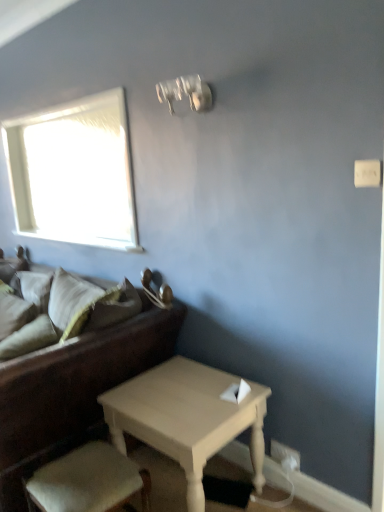
The height and width of the screenshot is (512, 384). What do you see at coordinates (29, 338) in the screenshot?
I see `soft beige pillow at left, the 1th pillow in the front-to-back sequence` at bounding box center [29, 338].

The image size is (384, 512). What are the coordinates of `light beige fabric armchair at lower left` in the screenshot? It's located at (88, 481).

The image size is (384, 512). What do you see at coordinates (88, 481) in the screenshot?
I see `light beige fabric armchair at lower left` at bounding box center [88, 481].

The width and height of the screenshot is (384, 512). In order to click on soft beige pillow at left, which ranks as the 2th pillow in front-to-back order in this screenshot , I will do `click(14, 313)`.

Based on their sizes in the image, would you say light beige fabric armchair at lower left is bigger or smaller than soft beige pillow at left, which ranks as the 2th pillow in front-to-back order?

Considering their sizes, light beige fabric armchair at lower left takes up less space than soft beige pillow at left, which ranks as the 2th pillow in front-to-back order.

Locate an element on the screen. This screenshot has height=512, width=384. armchair below the soft beige pillow at left, which ranks as the 2th pillow in front-to-back order (from the image's perspective) is located at coordinates (88, 481).

From the image's perspective, is light beige fabric armchair at lower left over soft beige pillow at left, which appears as the first pillow when viewed from the back?

Actually, light beige fabric armchair at lower left appears below soft beige pillow at left, which appears as the first pillow when viewed from the back, in the image.

Are soft beige pillow at left, which appears as the first pillow when viewed from the back, and dark brown leather couch at left beside each other?

soft beige pillow at left, which appears as the first pillow when viewed from the back, and dark brown leather couch at left are clearly separated.

Identify the location of pillow on the left side of dark brown leather couch at left. Image resolution: width=384 pixels, height=512 pixels. (14, 313).

How many degrees apart are the facing directions of soft beige pillow at left, which appears as the first pillow when viewed from the back, and dark brown leather couch at left?

0.892 degrees.

Is soft beige pillow at left, which ranks as the 2th pillow in front-to-back order, spatially inside dark brown leather couch at left, or outside of it?

soft beige pillow at left, which ranks as the 2th pillow in front-to-back order, is spatially positioned inside dark brown leather couch at left.

Does soft beige pillow at left, the 1th pillow in the front-to-back sequence, have a greater width compared to soft beige pillow at left, which appears as the first pillow when viewed from the back?

Correct, the width of soft beige pillow at left, the 1th pillow in the front-to-back sequence, exceeds that of soft beige pillow at left, which appears as the first pillow when viewed from the back.

Is soft beige pillow at left, marked as the 2th pillow in a back-to-front arrangement, to the right of soft beige pillow at left, which appears as the first pillow when viewed from the back, from the viewer's perspective?

Correct, you'll find soft beige pillow at left, marked as the 2th pillow in a back-to-front arrangement, to the right of soft beige pillow at left, which appears as the first pillow when viewed from the back.

Looking at this image, how different are the orientations of soft beige pillow at left, the 1th pillow in the front-to-back sequence, and soft beige pillow at left, which ranks as the 2th pillow in front-to-back order, in degrees?

19.5 degrees separate the facing orientations of soft beige pillow at left, the 1th pillow in the front-to-back sequence, and soft beige pillow at left, which ranks as the 2th pillow in front-to-back order.

Which of these two, soft beige pillow at left, which ranks as the 2th pillow in front-to-back order, or light wood table at center, is wider?

With larger width is light wood table at center.

Considering the positions of points (16, 329) and (134, 413), is point (16, 329) farther from camera compared to point (134, 413)?

Yes, it is.

Which is more to the left, soft beige pillow at left, which appears as the first pillow when viewed from the back, or light wood table at center?

soft beige pillow at left, which appears as the first pillow when viewed from the back.

Do you think soft beige pillow at left, which ranks as the 2th pillow in front-to-back order, is within light wood table at center, or outside of it?

soft beige pillow at left, which ranks as the 2th pillow in front-to-back order, is not inside light wood table at center, it's outside.

Is soft beige pillow at left, the 1th pillow in the front-to-back sequence, at the back of dark brown leather couch at left?

Absolutely, dark brown leather couch at left is directed away from soft beige pillow at left, the 1th pillow in the front-to-back sequence.

Between dark brown leather couch at left and soft beige pillow at left, the 1th pillow in the front-to-back sequence, which one is positioned in front?

Positioned in front is dark brown leather couch at left.

Which of these two, dark brown leather couch at left or soft beige pillow at left, marked as the 2th pillow in a back-to-front arrangement, stands shorter?

soft beige pillow at left, marked as the 2th pillow in a back-to-front arrangement, is shorter.

In terms of height, does light wood table at center look taller or shorter compared to soft beige pillow at left, which appears as the first pillow when viewed from the back?

light wood table at center is taller than soft beige pillow at left, which appears as the first pillow when viewed from the back.

Who is smaller, light wood table at center or soft beige pillow at left, which ranks as the 2th pillow in front-to-back order?

With smaller size is soft beige pillow at left, which ranks as the 2th pillow in front-to-back order.

Is light wood table at center in front of or behind soft beige pillow at left, which ranks as the 2th pillow in front-to-back order, in the image?

light wood table at center is positioned closer to the viewer than soft beige pillow at left, which ranks as the 2th pillow in front-to-back order.

Is point (54, 378) farther from viewer compared to point (9, 318)?

No, it is in front of (9, 318).

Who is bigger, dark brown leather couch at left or soft beige pillow at left, which ranks as the 2th pillow in front-to-back order?

With larger size is dark brown leather couch at left.

Measure the distance between dark brown leather couch at left and soft beige pillow at left, which ranks as the 2th pillow in front-to-back order.

A distance of 38.85 inches exists between dark brown leather couch at left and soft beige pillow at left, which ranks as the 2th pillow in front-to-back order.

Between dark brown leather couch at left and soft beige pillow at left, which appears as the first pillow when viewed from the back, which one has smaller width?

soft beige pillow at left, which appears as the first pillow when viewed from the back.

Identify the location of armchair below the soft beige pillow at left, which ranks as the 2th pillow in front-to-back order (from the image's perspective). (88, 481).

You are a GUI agent. You are given a task and a screenshot of the screen. Output one action in this format:
    pyautogui.click(x=<x>, y=<y>)
    Task: Click on the studio couch in front of the soft beige pillow at left, which ranks as the 2th pillow in front-to-back order
    
    Given the screenshot: What is the action you would take?
    pyautogui.click(x=73, y=389)

Based on their spatial positions, is soft beige pillow at left, marked as the 2th pillow in a back-to-front arrangement, or light beige fabric armchair at lower left closer to dark brown leather couch at left?

Among the two, light beige fabric armchair at lower left is located nearer to dark brown leather couch at left.

Looking at the image, which one is located closer to soft beige pillow at left, the 1th pillow in the front-to-back sequence, light beige fabric armchair at lower left or dark brown leather couch at left?

Among the two, dark brown leather couch at left is located nearer to soft beige pillow at left, the 1th pillow in the front-to-back sequence.

Estimate the real-world distances between objects in this image. Which object is closer to light beige fabric armchair at lower left, dark brown leather couch at left or light wood table at center?

light wood table at center.

Looking at the image, which one is located further to dark brown leather couch at left, soft beige pillow at left, marked as the 2th pillow in a back-to-front arrangement, or soft beige pillow at left, which ranks as the 2th pillow in front-to-back order?

soft beige pillow at left, which ranks as the 2th pillow in front-to-back order, lies further to dark brown leather couch at left than the other object.

When comparing their distances from soft beige pillow at left, the 1th pillow in the front-to-back sequence, does dark brown leather couch at left or light beige fabric armchair at lower left seem further?

light beige fabric armchair at lower left lies further to soft beige pillow at left, the 1th pillow in the front-to-back sequence, than the other object.

When comparing their distances from light wood table at center, does soft beige pillow at left, the 1th pillow in the front-to-back sequence, or dark brown leather couch at left seem further?

soft beige pillow at left, the 1th pillow in the front-to-back sequence, is positioned further to the anchor light wood table at center.

Based on the photo, from the image, which object appears to be nearer to dark brown leather couch at left, soft beige pillow at left, which appears as the first pillow when viewed from the back, or soft beige pillow at left, marked as the 2th pillow in a back-to-front arrangement?

soft beige pillow at left, marked as the 2th pillow in a back-to-front arrangement, lies closer to dark brown leather couch at left than the other object.

Which object lies further to the anchor point dark brown leather couch at left, soft beige pillow at left, which appears as the first pillow when viewed from the back, or light beige fabric armchair at lower left?

soft beige pillow at left, which appears as the first pillow when viewed from the back, is positioned further to the anchor dark brown leather couch at left.

The image size is (384, 512). Identify the location of pillow situated between soft beige pillow at left, which appears as the first pillow when viewed from the back, and light wood table at center from left to right. point(29,338).

Locate an element on the screen. studio couch between light beige fabric armchair at lower left and soft beige pillow at left, which appears as the first pillow when viewed from the back, from front to back is located at coordinates (73, 389).

I want to click on studio couch situated between soft beige pillow at left, which ranks as the 2th pillow in front-to-back order, and light wood table at center from left to right, so click(x=73, y=389).

This screenshot has height=512, width=384. In order to click on armchair situated between dark brown leather couch at left and light wood table at center from left to right in this screenshot , I will do `click(88, 481)`.